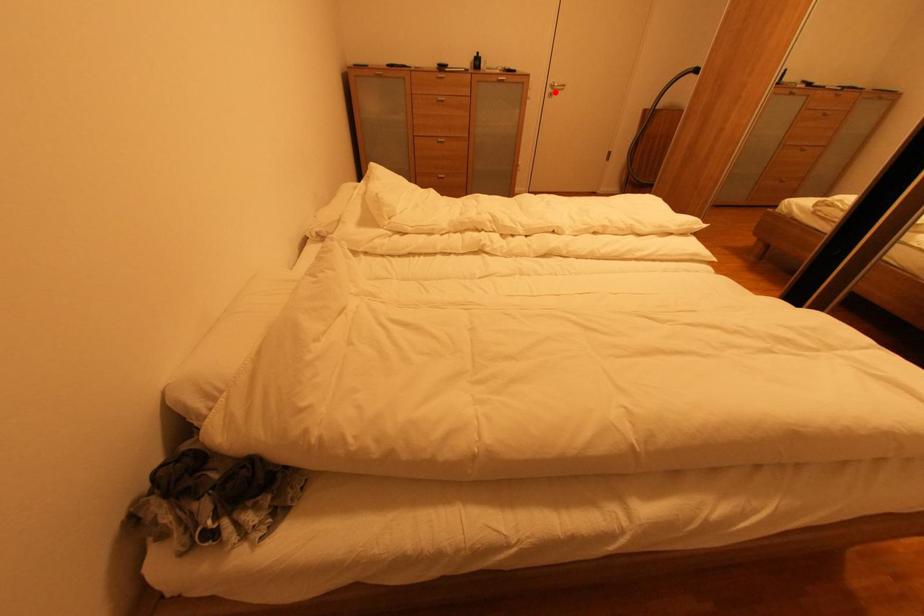
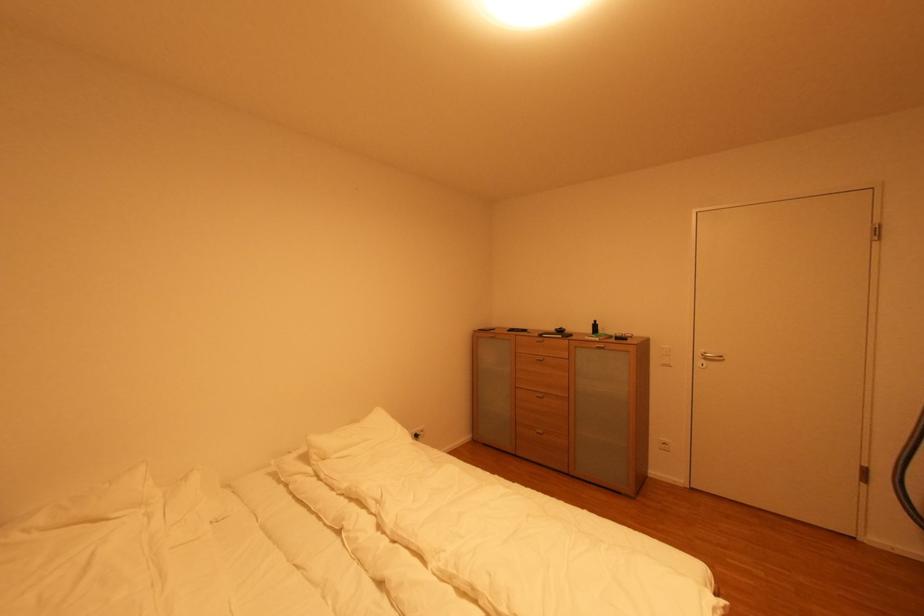
Question: A red point is marked in image1. In image2, is the corresponding 3D point closer to the camera or farther? Reply with the corresponding letter.

Choices:
 (A) The corresponding 3D point is closer.
 (B) The corresponding 3D point is farther.

Answer: (B)